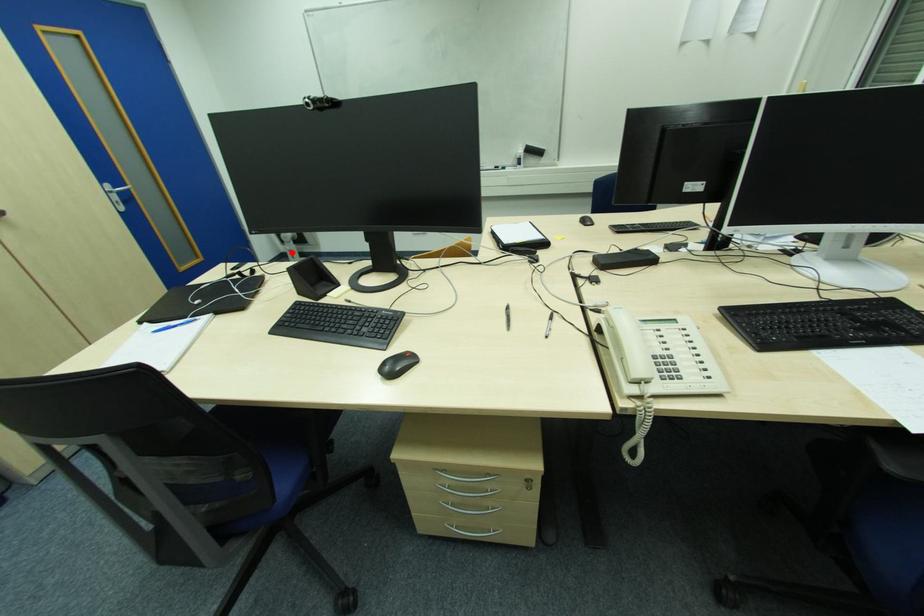
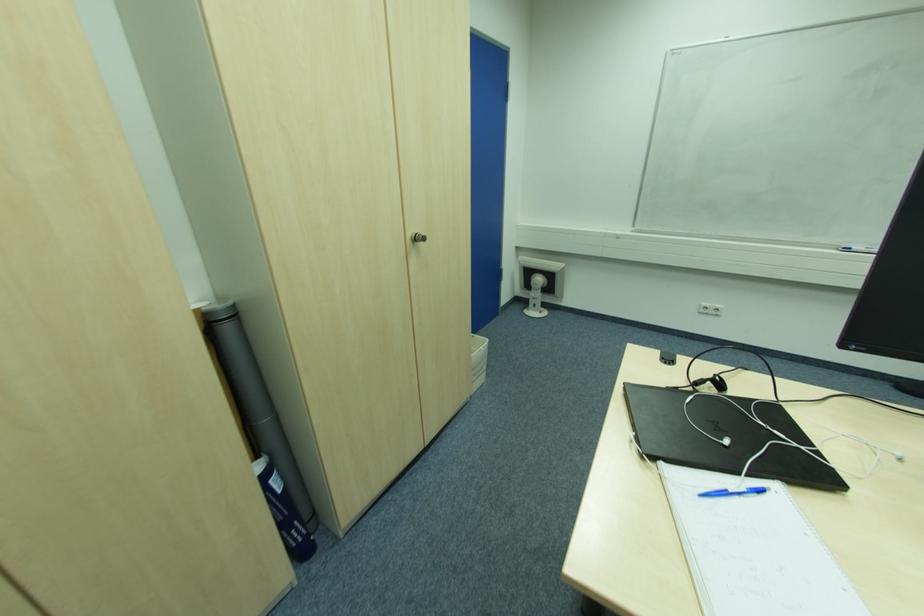
Question: A red point is marked in image1. In image2, is the corresponding 3D point closer to the camera or farther? Reply with the corresponding letter.

Choices:
 (A) The corresponding 3D point is closer.
 (B) The corresponding 3D point is farther.

Answer: (A)